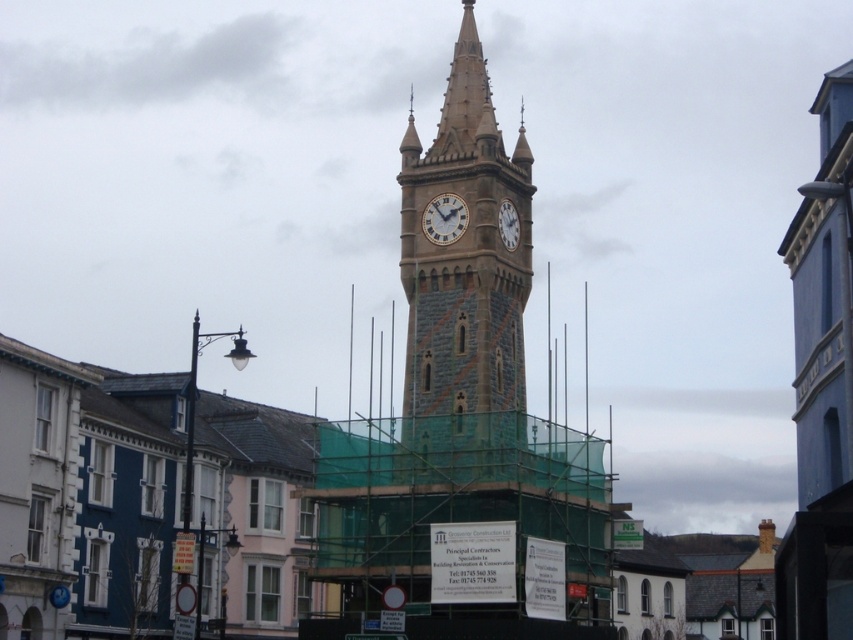
Question: Which point is farther to the camera?

Choices:
 (A) (447, 122)
 (B) (508, 234)
 (C) (444, 220)

Answer: (A)

Question: Which of the following is the farthest from the observer?

Choices:
 (A) stone clock tower at center
 (B) white textured clock at center
 (C) white painted clock face at center

Answer: (B)

Question: Considering the relative positions of stone clock tower at center and white painted clock face at center in the image provided, where is stone clock tower at center located with respect to white painted clock face at center?

Choices:
 (A) left
 (B) right

Answer: (B)

Question: Is white painted clock face at center closer to the viewer compared to white textured clock at center?

Choices:
 (A) no
 (B) yes

Answer: (B)

Question: Is stone clock tower at center thinner than white painted clock face at center?

Choices:
 (A) yes
 (B) no

Answer: (B)

Question: Which object is positioned farthest from the white painted clock face at center?

Choices:
 (A) white textured clock at center
 (B) stone clock tower at center

Answer: (B)